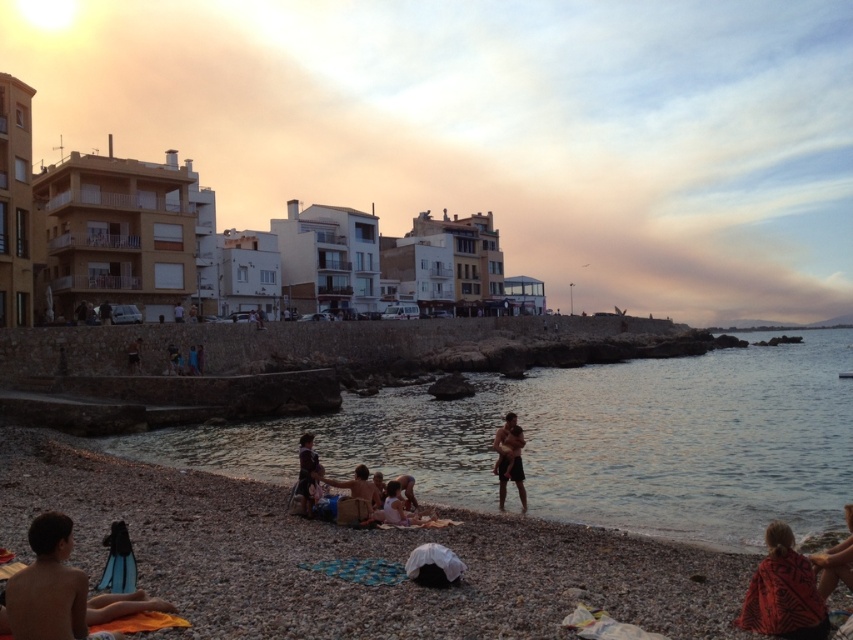
You are standing at the beach and want to walk towards both the point at coordinates point (300, 465) and the point at coordinates point (132, 369). Which point will you reach first?

You will reach point (300, 465) first because it is closer to you than point (132, 369).

You are standing at the center of the image and want to walk to the smooth pebble beach at lower left. In which general direction should you move?

To reach the smooth pebble beach at lower left, you should move towards the lower left direction since its 2D location is at point (352, 556).